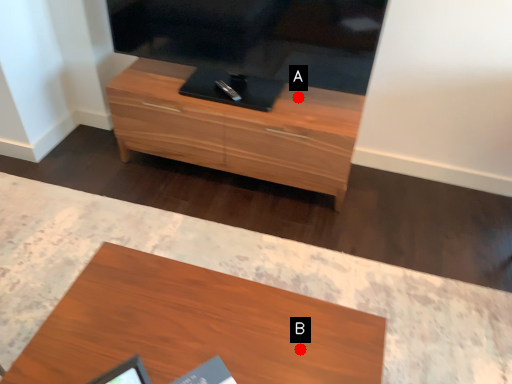
Question: Two points are circled on the image, labeled by A and B beside each circle. Which point is closer to the camera?

Choices:
 (A) A is closer
 (B) B is closer

Answer: (B)